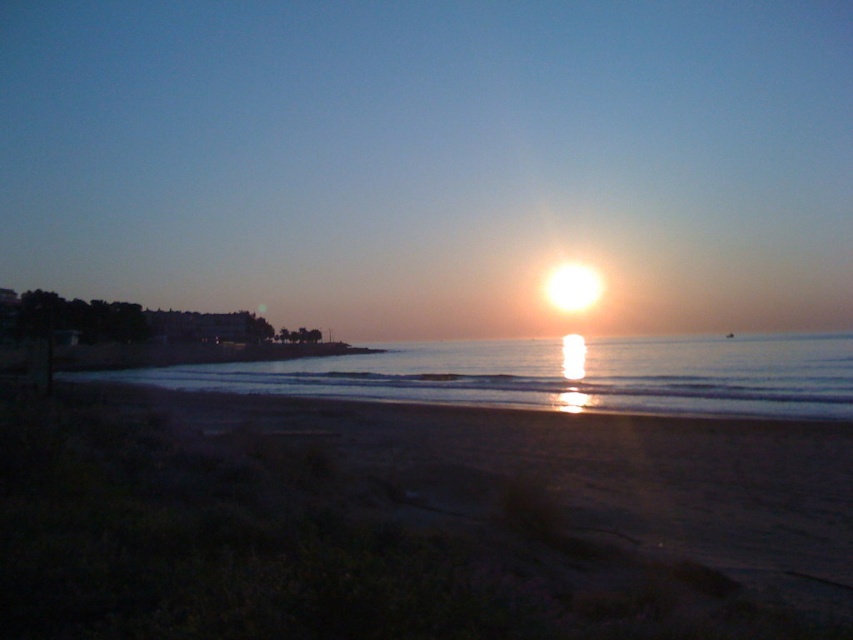
Question: Among these objects, which one is nearest to the camera?

Choices:
 (A) sandy beach at lower left
 (B) smooth water at center

Answer: (A)

Question: Is sandy beach at lower left to the right of smooth water at center from the viewer's perspective?

Choices:
 (A) yes
 (B) no

Answer: (B)

Question: Does sandy beach at lower left appear on the right side of smooth water at center?

Choices:
 (A) no
 (B) yes

Answer: (A)

Question: Is sandy beach at lower left behind smooth water at center?

Choices:
 (A) no
 (B) yes

Answer: (A)

Question: Which point is closer to the camera taking this photo?

Choices:
 (A) (183, 586)
 (B) (496, 381)

Answer: (A)